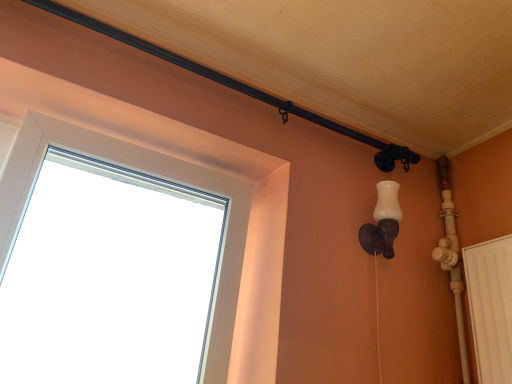
Question: Is white plastic window at upper left completely or partially inside white matte wall sconce at right?

Choices:
 (A) no
 (B) yes

Answer: (A)

Question: Does white matte wall sconce at right have a lesser width compared to white plastic window at upper left?

Choices:
 (A) yes
 (B) no

Answer: (A)

Question: From the image's perspective, is white matte wall sconce at right on top of white plastic window at upper left?

Choices:
 (A) no
 (B) yes

Answer: (A)

Question: From a real-world perspective, does white matte wall sconce at right stand above white plastic window at upper left?

Choices:
 (A) yes
 (B) no

Answer: (A)

Question: Is the depth of white matte wall sconce at right less than that of white plastic window at upper left?

Choices:
 (A) yes
 (B) no

Answer: (B)

Question: From a real-world perspective, is white matte wall sconce at right below white plastic window at upper left?

Choices:
 (A) no
 (B) yes

Answer: (A)

Question: Is white plastic window at upper left bigger than white matte wall sconce at right?

Choices:
 (A) yes
 (B) no

Answer: (A)

Question: From a real-world perspective, is white plastic window at upper left on top of white matte wall sconce at right?

Choices:
 (A) no
 (B) yes

Answer: (A)

Question: Does white plastic window at upper left have a greater width compared to white matte wall sconce at right?

Choices:
 (A) no
 (B) yes

Answer: (B)

Question: Is white plastic window at upper left facing towards white matte wall sconce at right?

Choices:
 (A) yes
 (B) no

Answer: (B)

Question: Considering the relative positions of white plastic window at upper left and white matte wall sconce at right in the image provided, is white plastic window at upper left behind white matte wall sconce at right?

Choices:
 (A) yes
 (B) no

Answer: (B)

Question: Is white plastic window at upper left oriented away from white matte wall sconce at right?

Choices:
 (A) no
 (B) yes

Answer: (A)

Question: From the image's perspective, is white matte wall sconce at right located above or below white plastic window at upper left?

Choices:
 (A) above
 (B) below

Answer: (B)